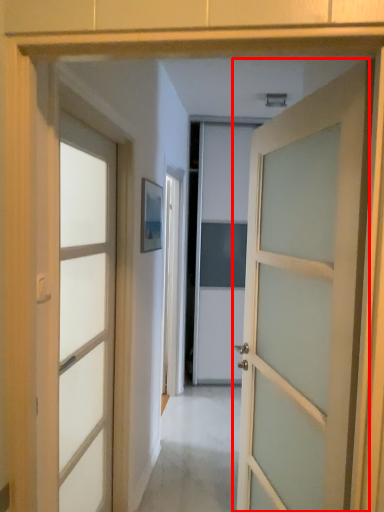
Question: From the image's perspective, what is the correct spatial positioning of door (annotated by the red box) in reference to door?

Choices:
 (A) below
 (B) above

Answer: (B)